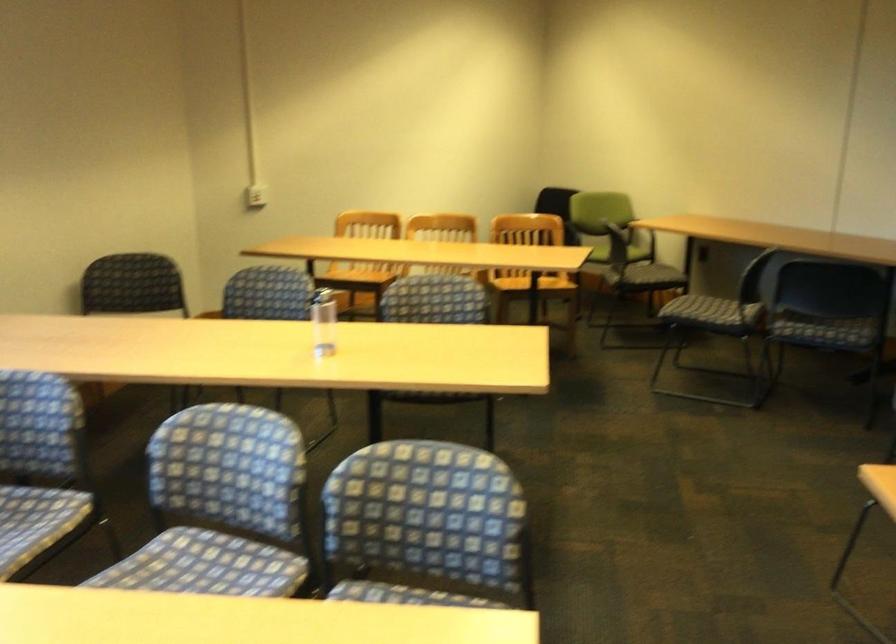
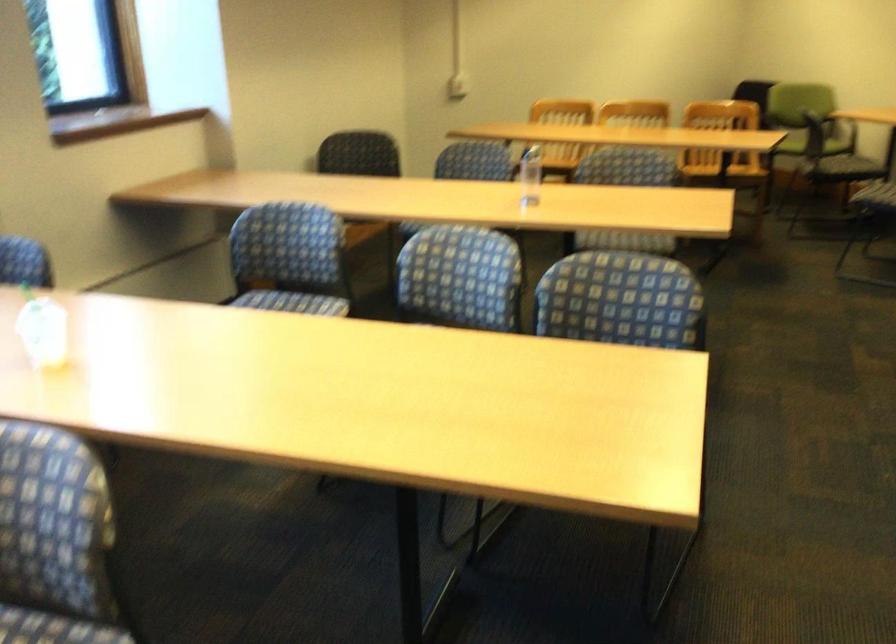
Find the pixel in the second image that matches (x=323, y=328) in the first image.

(530, 176)